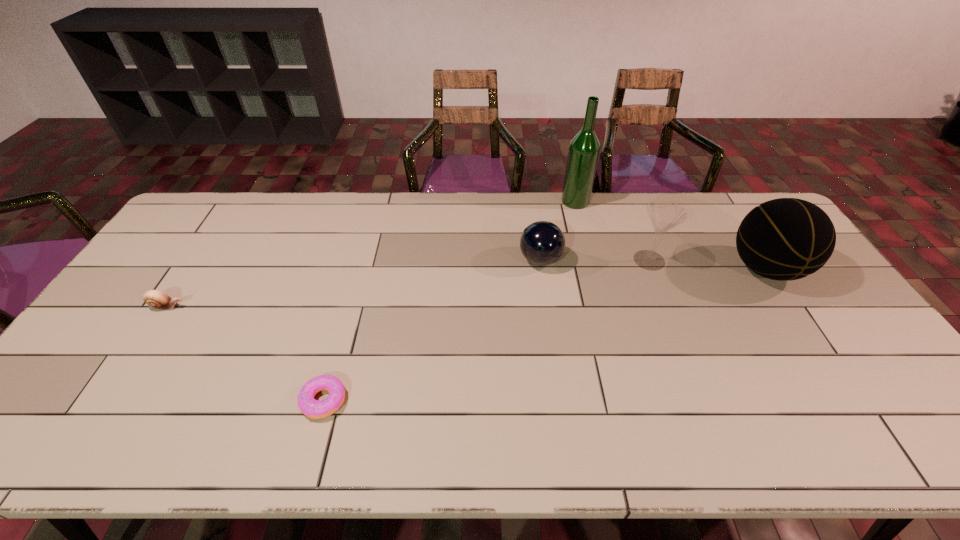
This screenshot has height=540, width=960. I want to click on blank region between the fourth shortest object and the third shortest object, so click(595, 260).

Identify the location of free space that is in between the alcohol and the second object from right to left. (612, 231).

You are a GUI agent. You are given a task and a screenshot of the screen. Output one action in this format:
    pyautogui.click(x=<x>, y=<y>)
    Task: Click on the free space between the tallest object and the basketball
    
    Given the screenshot: What is the action you would take?
    pyautogui.click(x=670, y=235)

The image size is (960, 540). Identify the location of free space that is in between the fifth object from left to right and the bowling ball. (595, 260).

Identify the location of free point between the basketball and the nearest object. (544, 335).

The width and height of the screenshot is (960, 540). I want to click on free space between the second object from right to left and the tallest object, so click(612, 231).

Locate which object ranks fourth in proximity to the third shortest object. Please provide its 2D coordinates. Your answer should be formatted as a tuple, i.e. [(x, y)], where the tuple contains the x and y coordinates of a point satisfying the conditions above.

[(314, 409)]

Identify the location of the fourth closest object to the bowling ball. (314, 409).

Find the location of a particular element. The image size is (960, 540). free spot that satisfies the following two spatial constraints: 1. on the side of the fourth object from right to left with the finger holes; 2. on the back side of the flute glass is located at coordinates (540, 260).